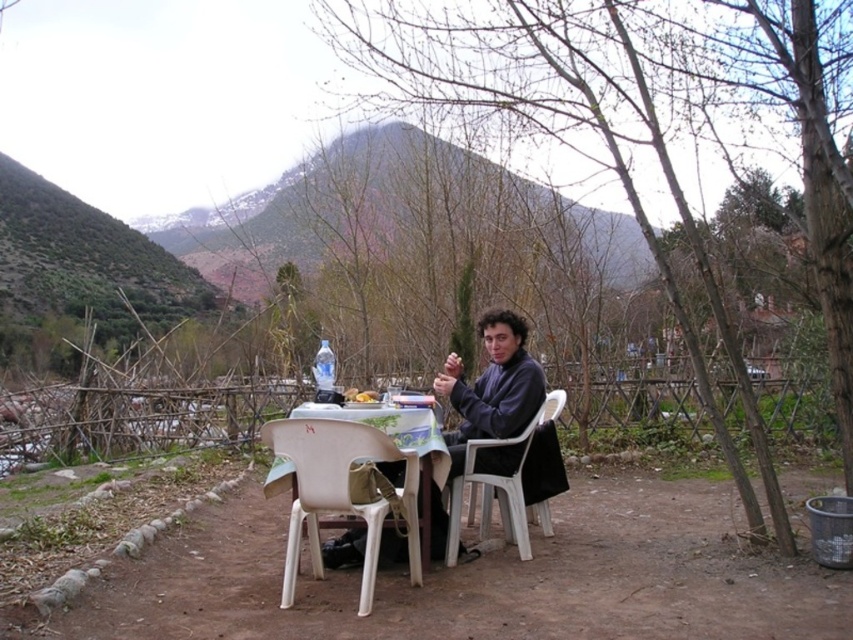
Question: Which object is the farthest from the white plastic chair at lower center?

Choices:
 (A) white plastic chair at center
 (B) dark blue sweater at center

Answer: (A)

Question: Which point is closer to the camera?

Choices:
 (A) (535, 390)
 (B) (410, 534)
 (C) (482, 508)

Answer: (B)

Question: Can you confirm if dark blue sweater at center is wider than white plastic chair at center?

Choices:
 (A) yes
 (B) no

Answer: (B)

Question: Can you confirm if dark blue sweater at center is positioned to the left of white plastic chair at center?

Choices:
 (A) no
 (B) yes

Answer: (B)

Question: Among these points, which one is farthest from the camera?

Choices:
 (A) (534, 502)
 (B) (412, 472)
 (C) (512, 378)

Answer: (A)

Question: Is white plastic chair at lower center below dark blue sweater at center?

Choices:
 (A) no
 (B) yes

Answer: (B)